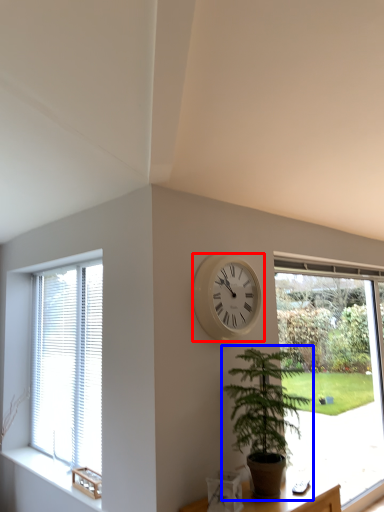
Question: Which object is further to the camera taking this photo, wall clock (highlighted by a red box) or houseplant (highlighted by a blue box)?

Choices:
 (A) wall clock
 (B) houseplant

Answer: (A)